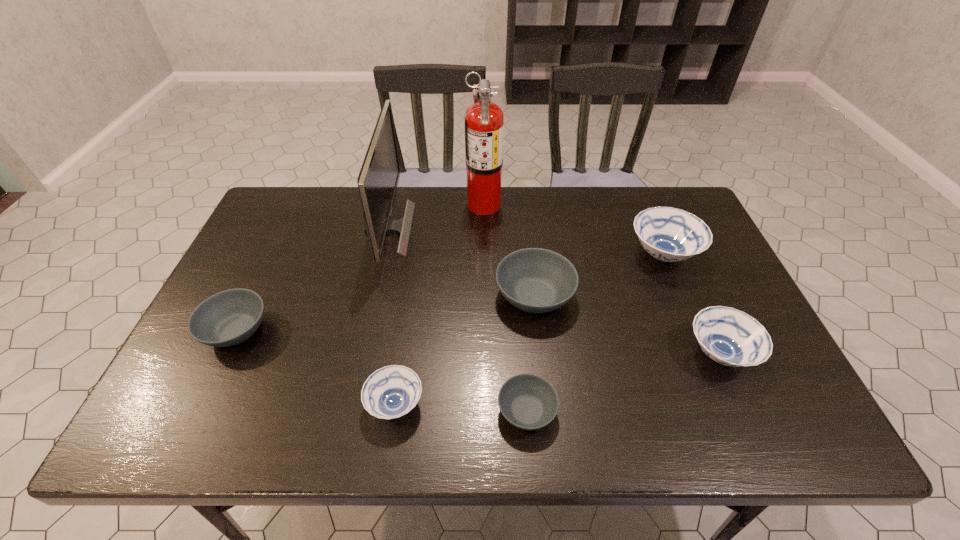
I want to click on vacant space that's between the biggest blue soup bowl and the second smallest blue soup bowl, so click(x=691, y=304).

Identify the location of empty space between the tallest object and the third tallest object. (573, 229).

Find the location of a particular element. The height and width of the screenshot is (540, 960). free space between the second tallest object and the second biggest gray soup bowl is located at coordinates (312, 279).

Locate which object ranks seventh in proximity to the leftmost gray soup bowl. Please provide its 2D coordinates. Your answer should be formatted as a tuple, i.e. [(x, y)], where the tuple contains the x and y coordinates of a point satisfying the conditions above.

[(731, 337)]

This screenshot has height=540, width=960. Identify the location of object that is the second closest one to the smallest gray soup bowl. (535, 280).

Point out which soup bowl is positioned as the fourth nearest to the second biggest blue soup bowl. Please provide its 2D coordinates. Your answer should be formatted as a tuple, i.e. [(x, y)], where the tuple contains the x and y coordinates of a point satisfying the conditions above.

[(390, 392)]

Locate which soup bowl is the third closest to the smallest blue soup bowl. Please provide its 2D coordinates. Your answer should be formatted as a tuple, i.e. [(x, y)], where the tuple contains the x and y coordinates of a point satisfying the conditions above.

[(230, 317)]

The height and width of the screenshot is (540, 960). I want to click on blue soup bowl that is the third closest to the monitor, so click(x=731, y=337).

Locate an element on the screen. This screenshot has width=960, height=540. blue soup bowl that stands as the closest to the leftmost gray soup bowl is located at coordinates (390, 392).

The width and height of the screenshot is (960, 540). I want to click on the second closest gray soup bowl to the biggest blue soup bowl, so click(x=527, y=401).